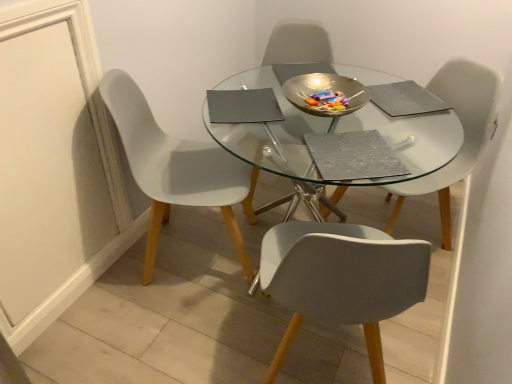
Where is `unoccupied area in front of white plastic chair at left, positioned as the first chair in left-to-right order`? unoccupied area in front of white plastic chair at left, positioned as the first chair in left-to-right order is located at coordinates (155, 332).